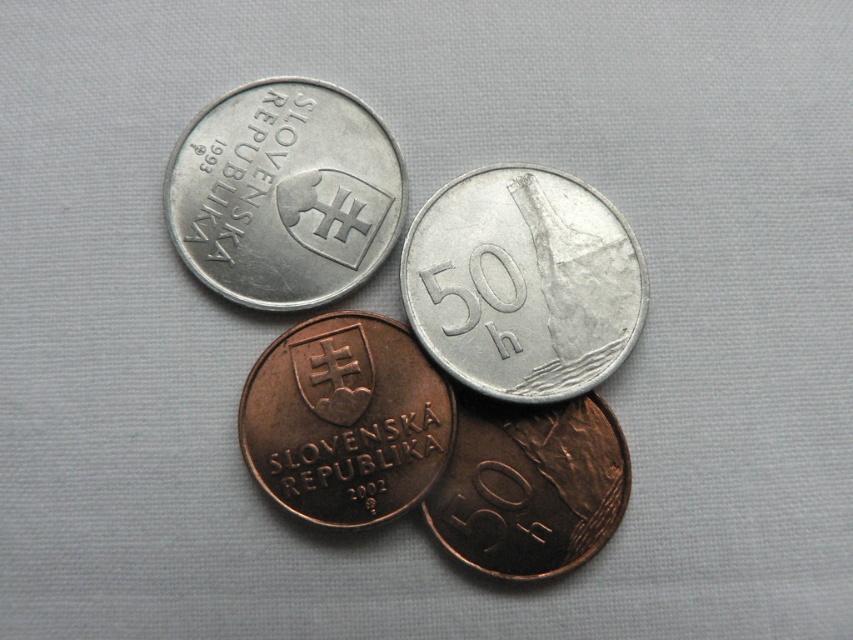
Which is behind, point (527, 328) or point (218, 264)?

Positioned behind is point (218, 264).

Which of these two, silver metallic coin at upper right or silver metallic coin at upper left, stands taller?

Standing taller between the two is silver metallic coin at upper right.

Which is behind, point (610, 244) or point (288, 168)?

The point (288, 168) is more distant.

Locate an element on the screen. silver metallic coin at upper right is located at coordinates (521, 284).

Does silver metallic coin at upper left appear under brown copper coin at center?

Incorrect, silver metallic coin at upper left is not positioned below brown copper coin at center.

Is silver metallic coin at upper left smaller than brown copper coin at center?

No, silver metallic coin at upper left is not smaller than brown copper coin at center.

Is point (251, 244) behind point (550, 516)?

Yes, it is.

You are a GUI agent. You are given a task and a screenshot of the screen. Output one action in this format:
    pyautogui.click(x=<x>, y=<y>)
    Task: Click on the silver metallic coin at upper left
    The width and height of the screenshot is (853, 640).
    Given the screenshot: What is the action you would take?
    pyautogui.click(x=283, y=193)

Who is lower down, silver metallic coin at upper left or bronze metallic coin at center?

bronze metallic coin at center is below.

Is silver metallic coin at upper left to the left of bronze metallic coin at center from the viewer's perspective?

Indeed, silver metallic coin at upper left is positioned on the left side of bronze metallic coin at center.

Is point (178, 141) positioned before point (283, 346)?

No, it is behind (283, 346).

Identify the location of silver metallic coin at upper left. The image size is (853, 640). (283, 193).